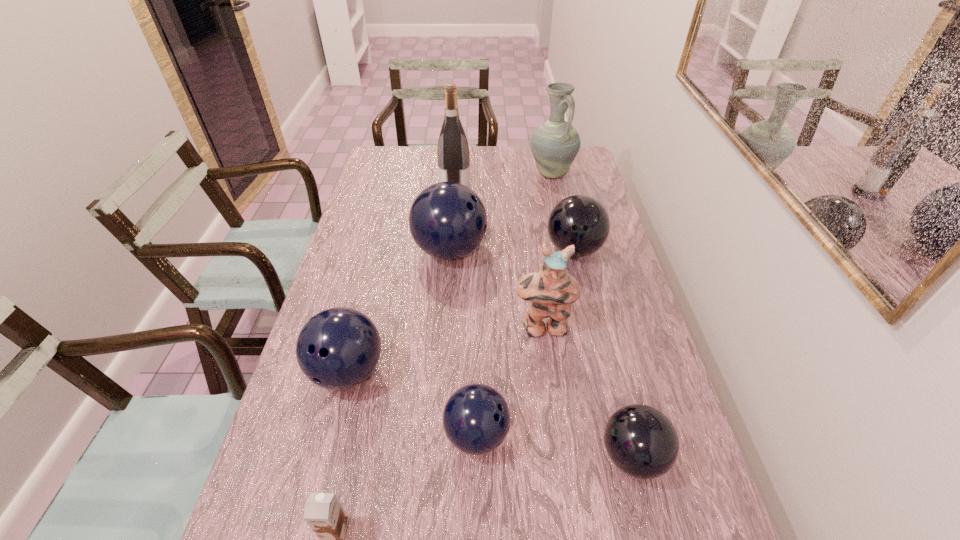
The width and height of the screenshot is (960, 540). I want to click on blue bowling ball object that ranks as the closest to the tallest bowling ball, so click(338, 348).

What are the coordinates of `blue bowling ball that stands as the third closest to the seventh shortest object` in the screenshot? It's located at (338, 348).

Locate an element on the screen. Image resolution: width=960 pixels, height=540 pixels. vacant space that satisfies the following two spatial constraints: 1. on the handle side of the eighth shortest object; 2. on the surface of the smallest blue bowling ball near the finger holes is located at coordinates (610, 435).

Image resolution: width=960 pixels, height=540 pixels. Identify the location of free spot that satisfies the following two spatial constraints: 1. on the label of the wine bottle; 2. on the surface of the leftmost bowling ball near the finger holes. (443, 372).

At what (x,y) coordinates should I click in order to perform the action: click on free space that satisfies the following two spatial constraints: 1. on the side of the bigger black bowling ball with the finger holes; 2. on the surface of the tallest bowling ball near the finger holes. Please return your answer as a coordinate pair (x, y). Looking at the image, I should click on (574, 251).